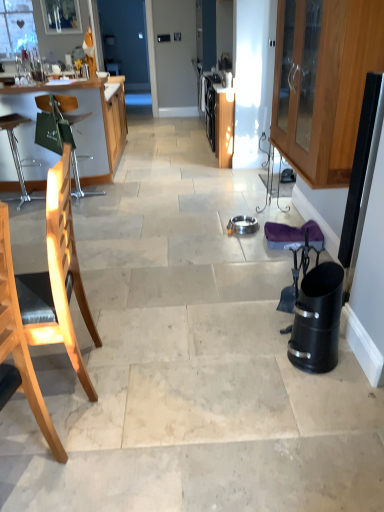
I want to click on free space below light wood chair at left, which is the third chair from back to front (from a real-world perspective), so click(x=22, y=481).